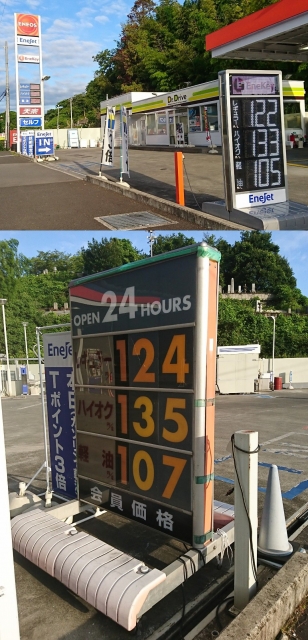
Identify the location of cord. (187, 573).